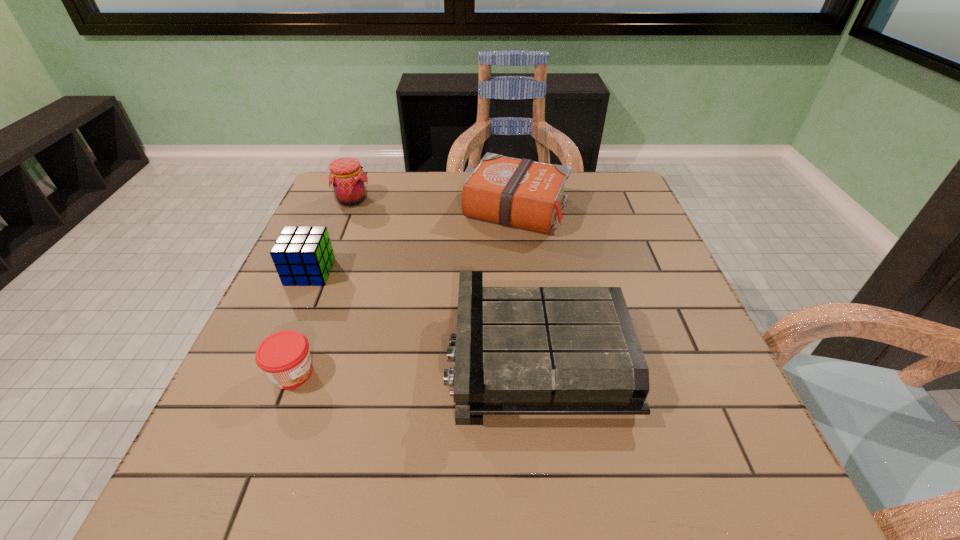
This screenshot has width=960, height=540. What are the coordinates of `the farther jam` in the screenshot? It's located at (347, 179).

Find the location of `Bible`. Bible is located at coordinates (522, 193).

Find the location of a particular element. cube is located at coordinates (303, 256).

Where is `radio receiver`? The width and height of the screenshot is (960, 540). radio receiver is located at coordinates (518, 350).

Identify the location of the nearer jam. The height and width of the screenshot is (540, 960). (284, 356).

Identify the location of the shortest object. Image resolution: width=960 pixels, height=540 pixels. (284, 356).

Find the location of a particular element. This screenshot has height=540, width=960. free space located on the front of the farther jam is located at coordinates (336, 239).

The width and height of the screenshot is (960, 540). In order to click on vacant space located 0.250m on the front of the Bible in this screenshot , I will do `click(528, 310)`.

Image resolution: width=960 pixels, height=540 pixels. What are the coordinates of `vacant position located on the front of the third farthest object` in the screenshot? It's located at (283, 333).

The image size is (960, 540). Identify the location of vacant point located on the front panel of the radio receiver. (397, 356).